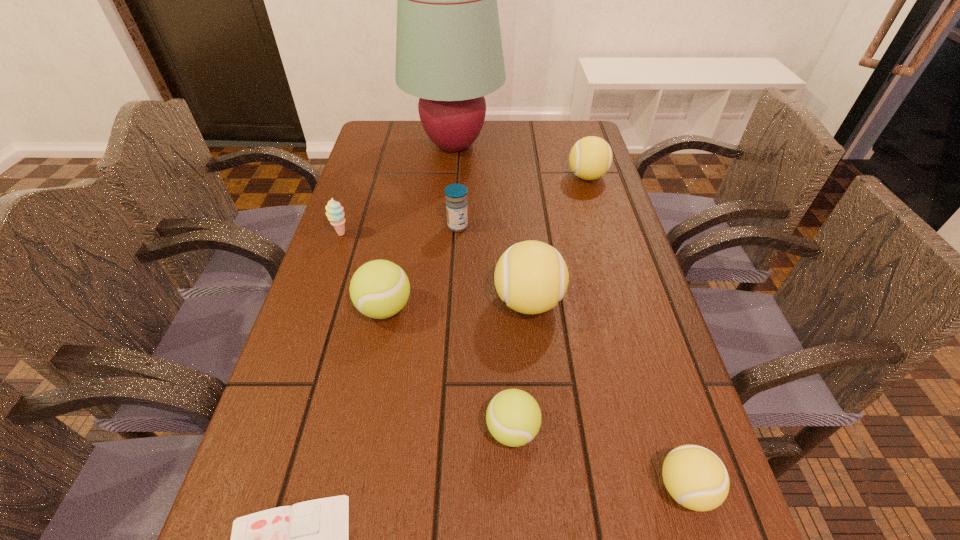
At what (x,y) coordinates should I click in order to perform the action: click on lampshade. Please return your answer as a coordinate pair (x, y). The image size is (960, 540). Looking at the image, I should click on (449, 53).

Locate an element on the screen. The width and height of the screenshot is (960, 540). blue lampshade is located at coordinates (449, 53).

Where is `the second nearest yellow tennis ball`? The height and width of the screenshot is (540, 960). the second nearest yellow tennis ball is located at coordinates (531, 276).

Locate an element on the screen. The image size is (960, 540). the eighth shortest object is located at coordinates (531, 276).

You are a GUI agent. You are given a task and a screenshot of the screen. Output one action in this format:
    pyautogui.click(x=<x>, y=<y>)
    Task: Click on the leftmost tennis ball
    This screenshot has height=540, width=960.
    Given the screenshot: What is the action you would take?
    pyautogui.click(x=379, y=289)

In order to click on the left green tennis ball in this screenshot , I will do `click(379, 289)`.

At what (x,y) coordinates should I click in order to perform the action: click on the farthest yellow tennis ball. Please return your answer as a coordinate pair (x, y). The height and width of the screenshot is (540, 960). Looking at the image, I should click on (590, 158).

The image size is (960, 540). Identify the location of the farthest tennis ball. (590, 158).

Identify the location of sherbert. This screenshot has width=960, height=540. (334, 211).

You are a GUI agent. You are given a task and a screenshot of the screen. Output one action in this format:
    pyautogui.click(x=<x>, y=<y>)
    Task: Click on the blue medicine
    This screenshot has height=540, width=960.
    Given the screenshot: What is the action you would take?
    pyautogui.click(x=456, y=203)